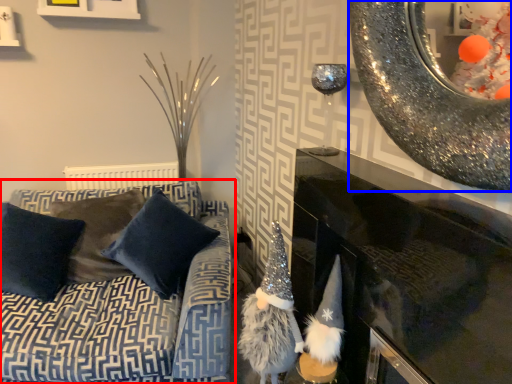
Question: Which object is further to the camera taking this photo, studio couch (highlighted by a red box) or oval (highlighted by a blue box)?

Choices:
 (A) studio couch
 (B) oval

Answer: (A)